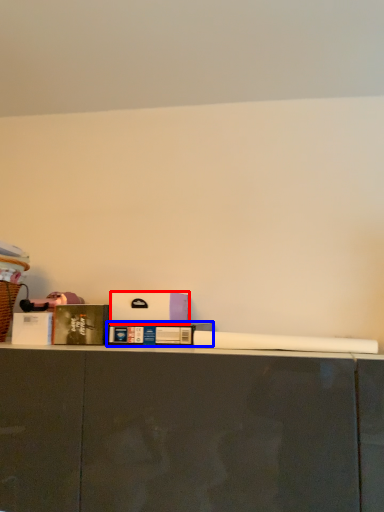
Question: Among these objects, which one is farthest to the camera, box (highlighted by a red box) or book (highlighted by a blue box)?

Choices:
 (A) box
 (B) book

Answer: (A)